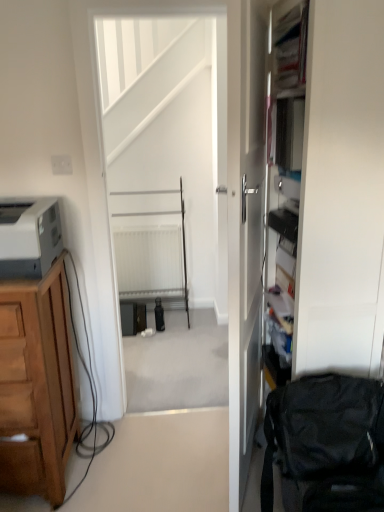
The width and height of the screenshot is (384, 512). In order to click on free space that is to the left of white glossy door at center in this screenshot , I will do `click(170, 463)`.